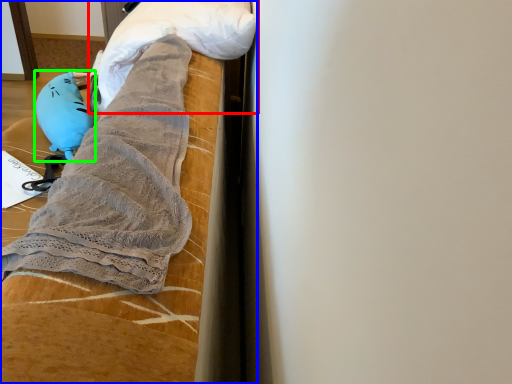
Question: Considering the real-world distances, which object is farthest from wrap (highlighted by a red box)? furniture (highlighted by a blue box) or toy (highlighted by a green box)?

Choices:
 (A) furniture
 (B) toy

Answer: (B)